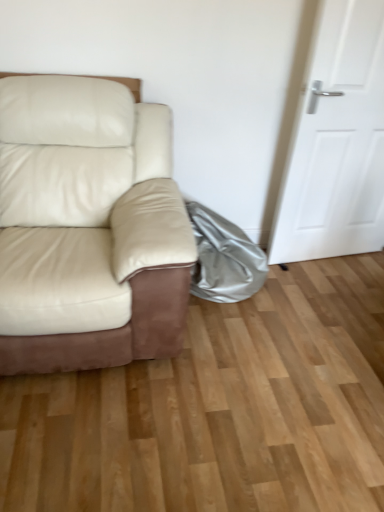
Find the location of a particular element. vacant region below white matte door at right (from a real-world perspective) is located at coordinates (329, 257).